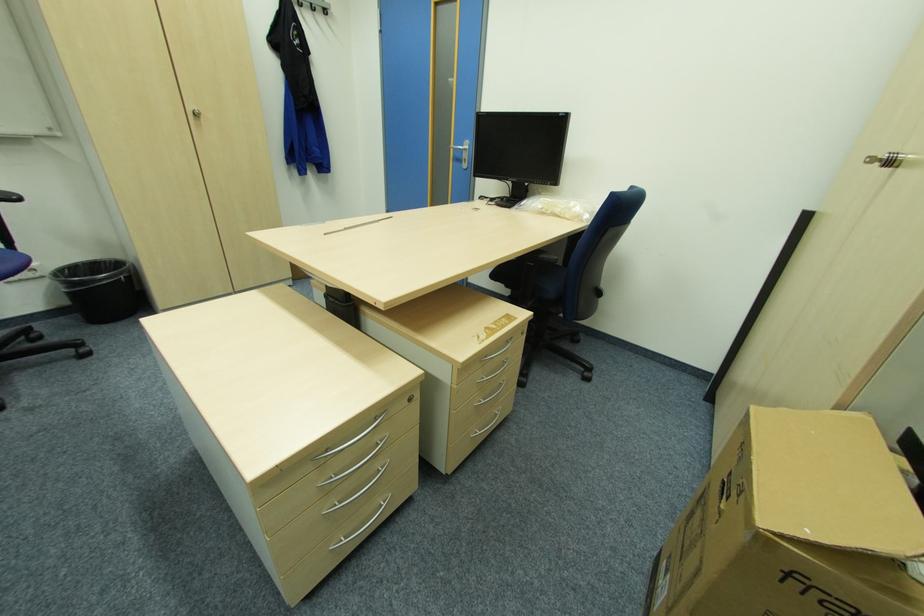
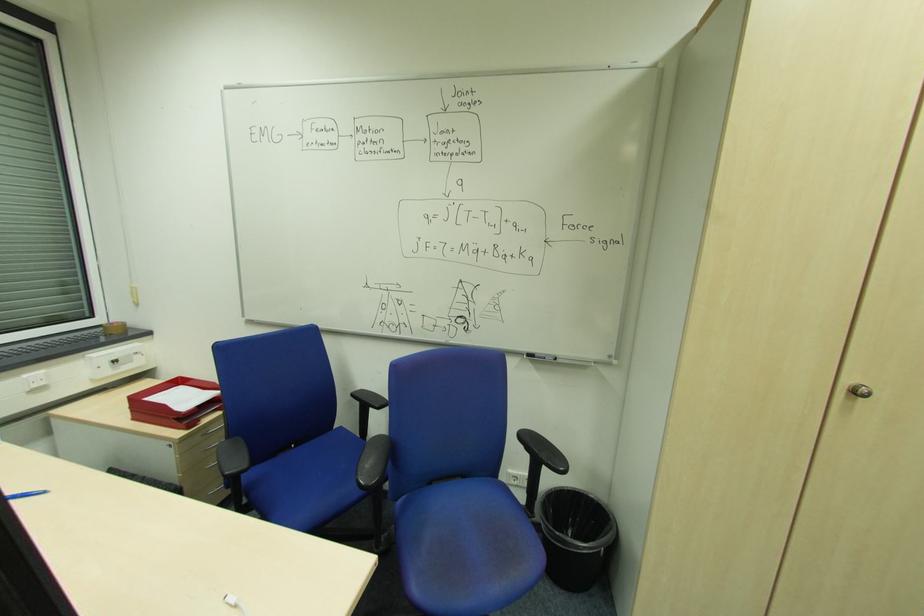
Find the pixel in the second image that matches the point at 201,115 in the first image.

(860, 392)